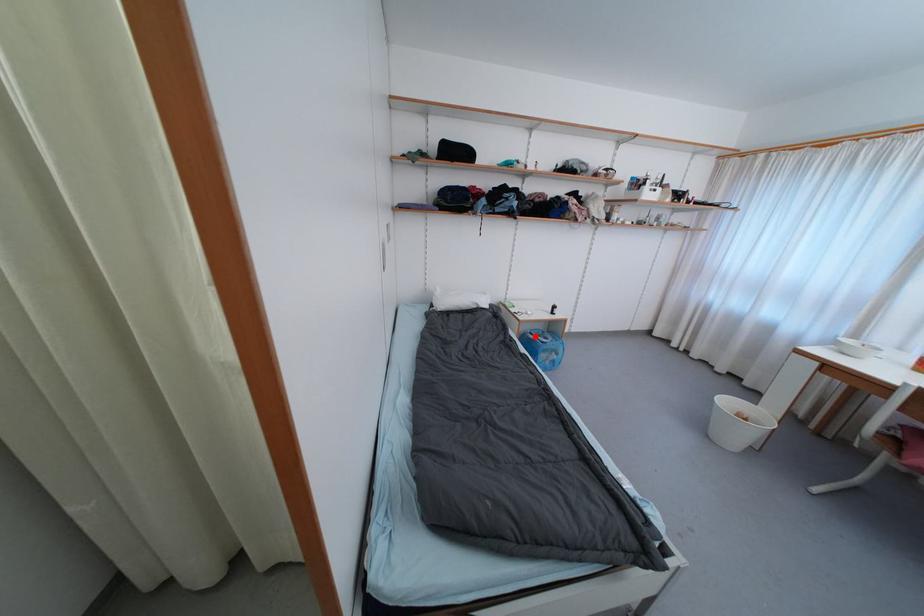
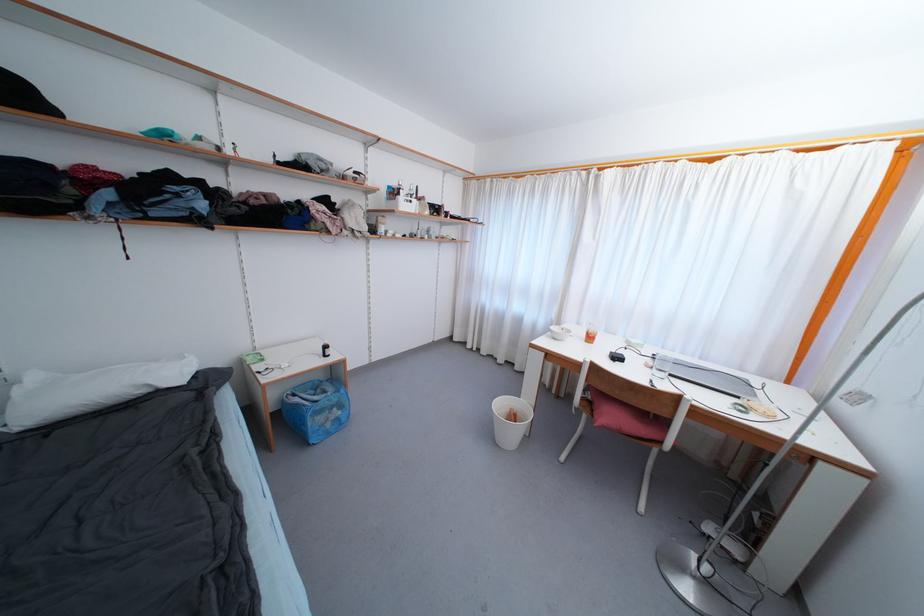
Question: I am providing you with two images of the same scene from different viewpoints. Given a red point in image1, look at the same physical point in image2. Is it:

Choices:
 (A) Closer to the viewpoint
 (B) Farther from the viewpoint

Answer: (A)